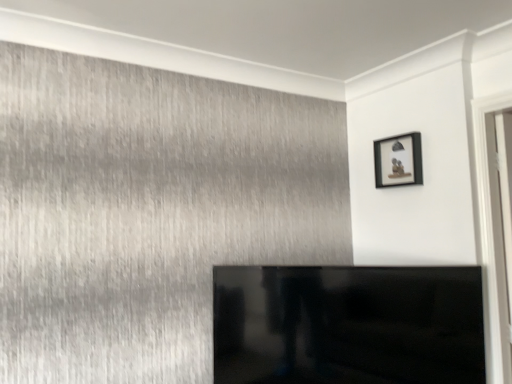
What is the approximate height of matte black picture frame at upper right?

11.02 inches.

The height and width of the screenshot is (384, 512). Describe the element at coordinates (398, 160) in the screenshot. I see `matte black picture frame at upper right` at that location.

Where is `matte black picture frame at upper right`? This screenshot has height=384, width=512. matte black picture frame at upper right is located at coordinates (398, 160).

What do you see at coordinates (348, 325) in the screenshot? I see `black glossy tv at center` at bounding box center [348, 325].

At what (x,y) coordinates should I click in order to perform the action: click on black glossy tv at center. Please return your answer as a coordinate pair (x, y). Looking at the image, I should click on (348, 325).

The height and width of the screenshot is (384, 512). In order to click on matte black picture frame at upper right in this screenshot , I will do `click(398, 160)`.

Is black glossy tv at center at the left side of matte black picture frame at upper right?

Yes.

From the picture: Which is behind, black glossy tv at center or matte black picture frame at upper right?

matte black picture frame at upper right is further away from the camera.

Which is in front, point (476, 300) or point (386, 142)?

The point (476, 300) is closer.

From the image's perspective, which is below, black glossy tv at center or matte black picture frame at upper right?

black glossy tv at center appears lower in the image.

From a real-world perspective, which is physically above, black glossy tv at center or matte black picture frame at upper right?

matte black picture frame at upper right, from a real-world perspective.

Which object is thinner, black glossy tv at center or matte black picture frame at upper right?

matte black picture frame at upper right.

Does black glossy tv at center have a greater height compared to matte black picture frame at upper right?

Indeed, black glossy tv at center has a greater height compared to matte black picture frame at upper right.

Considering the sizes of black glossy tv at center and matte black picture frame at upper right in the image, is black glossy tv at center bigger or smaller than matte black picture frame at upper right?

Clearly, black glossy tv at center is larger in size than matte black picture frame at upper right.

Is matte black picture frame at upper right located within black glossy tv at center?

No, matte black picture frame at upper right is located outside of black glossy tv at center.

Is black glossy tv at center with matte black picture frame at upper right?

No, black glossy tv at center is not beside matte black picture frame at upper right.

Is black glossy tv at center positioned with its back to matte black picture frame at upper right?

black glossy tv at center is not turned away from matte black picture frame at upper right.

Locate an element on the screen. The width and height of the screenshot is (512, 384). picture frame that appears above the black glossy tv at center (from a real-world perspective) is located at coordinates (398, 160).

Which object is positioned more to the left, matte black picture frame at upper right or black glossy tv at center?

Positioned to the left is black glossy tv at center.

Which is in front, matte black picture frame at upper right or black glossy tv at center?

black glossy tv at center is in front.

Considering the positions of points (412, 164) and (394, 311), is point (412, 164) farther from camera compared to point (394, 311)?

Yes, point (412, 164) is farther from viewer.

From the image's perspective, is matte black picture frame at upper right under black glossy tv at center?

No.

From a real-world perspective, is matte black picture frame at upper right on black glossy tv at center?

Yes, from a real-world perspective, matte black picture frame at upper right is above black glossy tv at center.

Considering the sizes of objects matte black picture frame at upper right and black glossy tv at center in the image provided, who is thinner, matte black picture frame at upper right or black glossy tv at center?

Thinner between the two is matte black picture frame at upper right.

Does matte black picture frame at upper right have a lesser height compared to black glossy tv at center?

Yes.

Looking at the image, does matte black picture frame at upper right seem bigger or smaller compared to black glossy tv at center?

In the image, matte black picture frame at upper right appears to be smaller than black glossy tv at center.

Is black glossy tv at center a part of matte black picture frame at upper right?

That's incorrect, black glossy tv at center is not inside matte black picture frame at upper right.

Is matte black picture frame at upper right far from black glossy tv at center?

matte black picture frame at upper right is actually quite close to black glossy tv at center.

Is black glossy tv at center at the back of matte black picture frame at upper right?

No.

This screenshot has width=512, height=384. What are the coordinates of `picture frame lying on the right of black glossy tv at center` in the screenshot? It's located at (398, 160).

You are a GUI agent. You are given a task and a screenshot of the screen. Output one action in this format:
    pyautogui.click(x=<x>, y=<y>)
    Task: Click on the furniture below the matte black picture frame at upper right (from the image's perspective)
    The height and width of the screenshot is (384, 512).
    Given the screenshot: What is the action you would take?
    pos(348,325)

You are a GUI agent. You are given a task and a screenshot of the screen. Output one action in this format:
    pyautogui.click(x=<x>, y=<y>)
    Task: Click on the furniture in front of the matte black picture frame at upper right
    The image size is (512, 384).
    Given the screenshot: What is the action you would take?
    pyautogui.click(x=348, y=325)